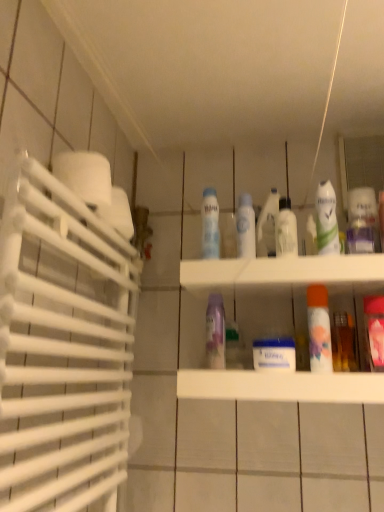
Question: Should I look upward or downward to see clear plastic bottle at center, the second mouthwash positioned from the left?

Choices:
 (A) up
 (B) down

Answer: (A)

Question: Would you say pink glossy mouthwash at right, placed as the 4th mouthwash when sorted from left to right, is outside orange matte mouthwash at center-right, placed as the 3th mouthwash when sorted from left to right?

Choices:
 (A) yes
 (B) no

Answer: (A)

Question: Can you confirm if pink glossy mouthwash at right, placed as the 4th mouthwash when sorted from left to right, is positioned to the left of orange matte mouthwash at center-right, which is the 2th mouthwash in right-to-left order?

Choices:
 (A) yes
 (B) no

Answer: (B)

Question: Does pink glossy mouthwash at right, which ranks as the 1th mouthwash in right-to-left order, have a smaller size compared to orange matte mouthwash at center-right, placed as the 3th mouthwash when sorted from left to right?

Choices:
 (A) yes
 (B) no

Answer: (B)

Question: Is pink glossy mouthwash at right, placed as the 4th mouthwash when sorted from left to right, surrounding orange matte mouthwash at center-right, which is the 2th mouthwash in right-to-left order?

Choices:
 (A) no
 (B) yes

Answer: (A)

Question: From a real-world perspective, is pink glossy mouthwash at right, which ranks as the 1th mouthwash in right-to-left order, on orange matte mouthwash at center-right, placed as the 3th mouthwash when sorted from left to right?

Choices:
 (A) yes
 (B) no

Answer: (B)

Question: From a real-world perspective, is pink glossy mouthwash at right, which ranks as the 1th mouthwash in right-to-left order, under orange matte mouthwash at center-right, placed as the 3th mouthwash when sorted from left to right?

Choices:
 (A) yes
 (B) no

Answer: (A)

Question: Considering the relative sizes of purple glossy spray can at center, acting as the second cleaning product starting from the left, and white matte toilet paper at left in the image provided, is purple glossy spray can at center, acting as the second cleaning product starting from the left, smaller than white matte toilet paper at left?

Choices:
 (A) no
 (B) yes

Answer: (B)

Question: From the image's perspective, is purple glossy spray can at center, acting as the second cleaning product starting from the left, on white matte toilet paper at left?

Choices:
 (A) yes
 (B) no

Answer: (B)

Question: Does purple glossy spray can at center, the fourth cleaning product in the right-to-left sequence, have a lesser height compared to white matte toilet paper at left?

Choices:
 (A) no
 (B) yes

Answer: (A)

Question: Is purple glossy spray can at center, the fourth cleaning product in the right-to-left sequence, located outside white matte toilet paper at left?

Choices:
 (A) yes
 (B) no

Answer: (A)

Question: From a real-world perspective, is purple glossy spray can at center, acting as the second cleaning product starting from the left, under white matte toilet paper at left?

Choices:
 (A) yes
 (B) no

Answer: (A)

Question: Is purple glossy spray can at center, the fourth cleaning product in the right-to-left sequence, looking in the opposite direction of white matte toilet paper at left?

Choices:
 (A) no
 (B) yes

Answer: (A)

Question: Is white matte spray can at center, which ranks as the 1th cleaning product in left-to-right order, next to orange matte mouthwash at center-right, placed as the 3th mouthwash when sorted from left to right, and touching it?

Choices:
 (A) no
 (B) yes

Answer: (A)